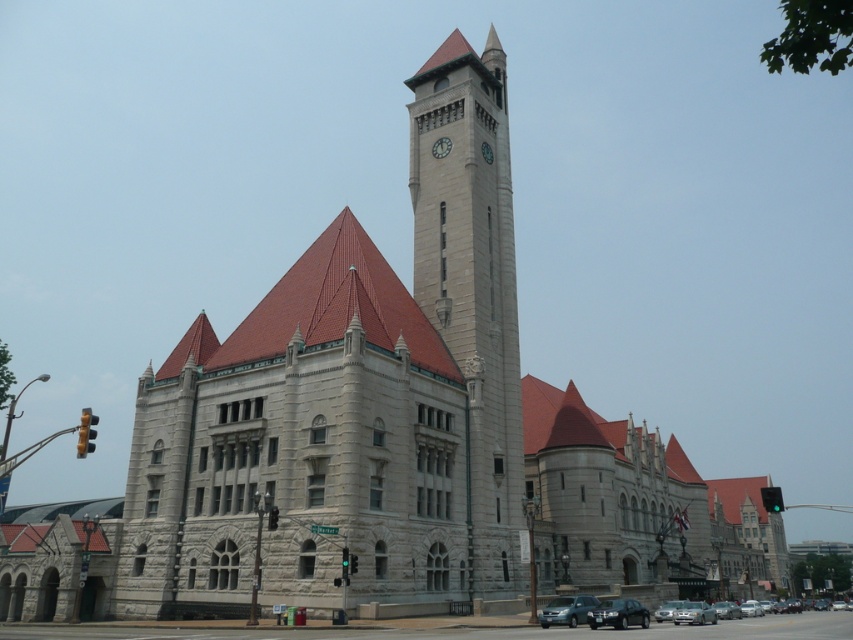
Question: Which point is farther to the camera?

Choices:
 (A) metallic silver car at lower center
 (B) white stone clock at upper center
 (C) metallic clock at center
 (D) stone clock tower at center

Answer: (C)

Question: Can you confirm if metallic silver car at lower center is smaller than white stone clock at upper center?

Choices:
 (A) yes
 (B) no

Answer: (B)

Question: Among these points, which one is nearest to the camera?

Choices:
 (A) (422, 196)
 (B) (711, 621)
 (C) (579, 612)
 (D) (596, 620)

Answer: (D)

Question: Which object appears closest to the camera in this image?

Choices:
 (A) shiny black suv at lower center
 (B) metallic silver sedan at lower center
 (C) metallic silver car at lower center

Answer: (A)

Question: Is shiny black suv at lower center bigger than metallic clock at center?

Choices:
 (A) no
 (B) yes

Answer: (B)

Question: Does metallic silver sedan at lower center come behind metallic silver car at lower center?

Choices:
 (A) no
 (B) yes

Answer: (A)